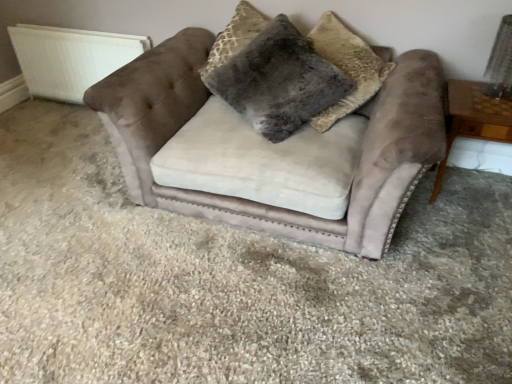
Question: From a real-world perspective, does wooden side table at right sit lower than white textured radiator at upper left?

Choices:
 (A) no
 (B) yes

Answer: (B)

Question: Is the depth of wooden side table at right greater than that of white textured radiator at upper left?

Choices:
 (A) no
 (B) yes

Answer: (A)

Question: From the image's perspective, is wooden side table at right located beneath white textured radiator at upper left?

Choices:
 (A) yes
 (B) no

Answer: (A)

Question: Would you say white textured radiator at upper left is part of wooden side table at right's contents?

Choices:
 (A) no
 (B) yes

Answer: (A)

Question: Is wooden side table at right taller than white textured radiator at upper left?

Choices:
 (A) no
 (B) yes

Answer: (B)

Question: Is wooden side table at right directly adjacent to white textured radiator at upper left?

Choices:
 (A) no
 (B) yes

Answer: (A)

Question: Is wooden side table at right facing away from fuzzy gray pillow at center, which is counted as the 2th pillow, starting from the right?

Choices:
 (A) yes
 (B) no

Answer: (B)

Question: From the image's perspective, is wooden side table at right located beneath fuzzy gray pillow at center, which is counted as the 2th pillow, starting from the right?

Choices:
 (A) yes
 (B) no

Answer: (A)

Question: Is wooden side table at right thinner than fuzzy gray pillow at center, which is the first pillow from left to right?

Choices:
 (A) yes
 (B) no

Answer: (B)

Question: Is wooden side table at right not near fuzzy gray pillow at center, which is counted as the 2th pillow, starting from the right?

Choices:
 (A) yes
 (B) no

Answer: (B)

Question: Can you confirm if wooden side table at right is bigger than fuzzy gray pillow at center, which is counted as the 2th pillow, starting from the right?

Choices:
 (A) no
 (B) yes

Answer: (A)

Question: Does wooden side table at right lie in front of fuzzy gray pillow at center, which is counted as the 2th pillow, starting from the right?

Choices:
 (A) no
 (B) yes

Answer: (B)

Question: Is velvet couch at center wider than white textured radiator at upper left?

Choices:
 (A) no
 (B) yes

Answer: (B)